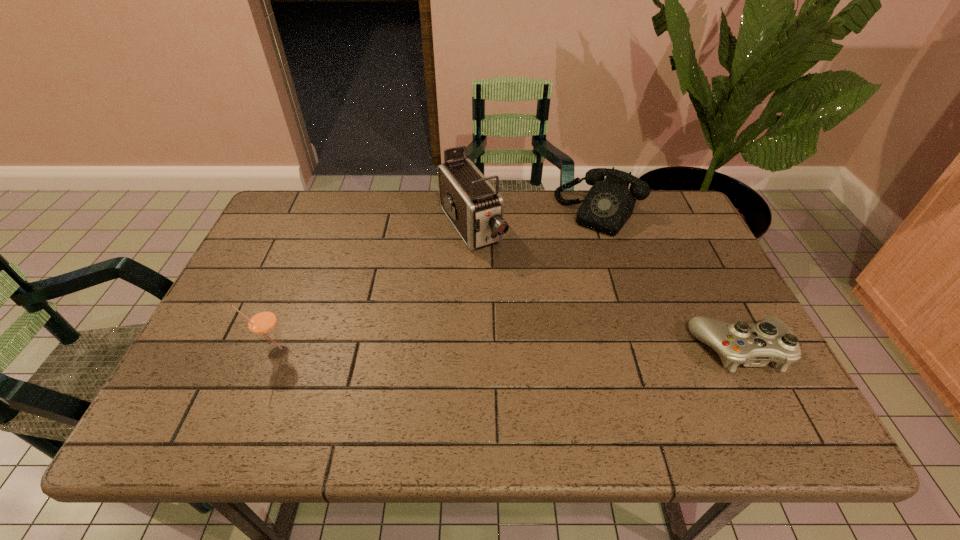
This screenshot has width=960, height=540. Find the location of `free space located 0.110m at the lens of the second object from left to right`. free space located 0.110m at the lens of the second object from left to right is located at coordinates (505, 282).

Image resolution: width=960 pixels, height=540 pixels. I want to click on vacant point located 0.050m on the dial of the telephone, so click(x=577, y=244).

Find the location of `free spot located on the dial of the telephone`. free spot located on the dial of the telephone is located at coordinates (531, 312).

The height and width of the screenshot is (540, 960). Find the location of `free space located on the dial of the telephone`. free space located on the dial of the telephone is located at coordinates (572, 252).

Image resolution: width=960 pixels, height=540 pixels. I want to click on camcorder positioned at the far edge, so click(x=475, y=208).

The image size is (960, 540). I want to click on telephone present at the far edge, so click(609, 204).

You are a GUI agent. You are given a task and a screenshot of the screen. Output one action in this format:
    pyautogui.click(x=<x>, y=<y>)
    Task: Click on the straw present at the near edge
    This screenshot has height=540, width=960.
    Given the screenshot: What is the action you would take?
    pyautogui.click(x=262, y=322)

This screenshot has height=540, width=960. I want to click on control that is at the near edge, so click(754, 345).

This screenshot has height=540, width=960. Identify the location of object that is at the left edge. (262, 322).

Image resolution: width=960 pixels, height=540 pixels. I want to click on control that is at the right edge, so click(x=754, y=345).